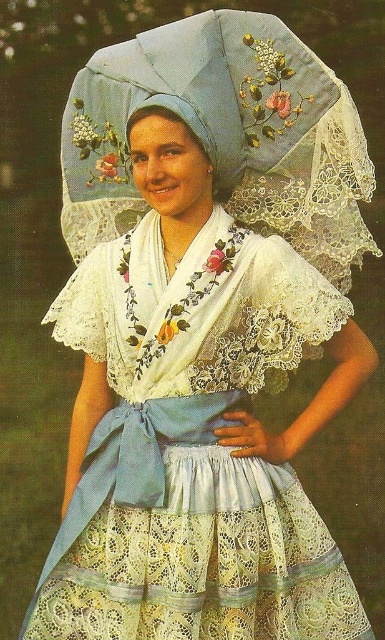
Does lace fabric umbrella at upper center have a lesser width compared to light blue lace headdress at center?

No.

How much distance is there between lace fabric umbrella at upper center and light blue lace headdress at center?

lace fabric umbrella at upper center is 11.04 centimeters away from light blue lace headdress at center.

The image size is (385, 640). I want to click on lace fabric umbrella at upper center, so click(224, 134).